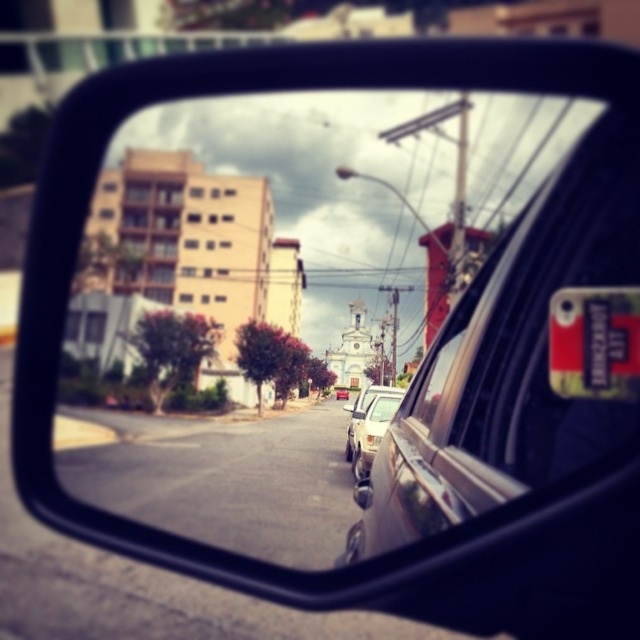
Question: Does white matte car at center have a smaller size compared to white plastic license plate at center?

Choices:
 (A) yes
 (B) no

Answer: (B)

Question: Which point is closer to the camera?

Choices:
 (A) (388, 406)
 (B) (378, 442)

Answer: (B)

Question: Which object is closer to the camera taking this photo?

Choices:
 (A) white plastic license plate at center
 (B) white matte car at center

Answer: (A)

Question: Can you confirm if white matte car at center is positioned above white plastic license plate at center?

Choices:
 (A) yes
 (B) no

Answer: (B)

Question: Does white matte car at center have a smaller size compared to white plastic license plate at center?

Choices:
 (A) no
 (B) yes

Answer: (A)